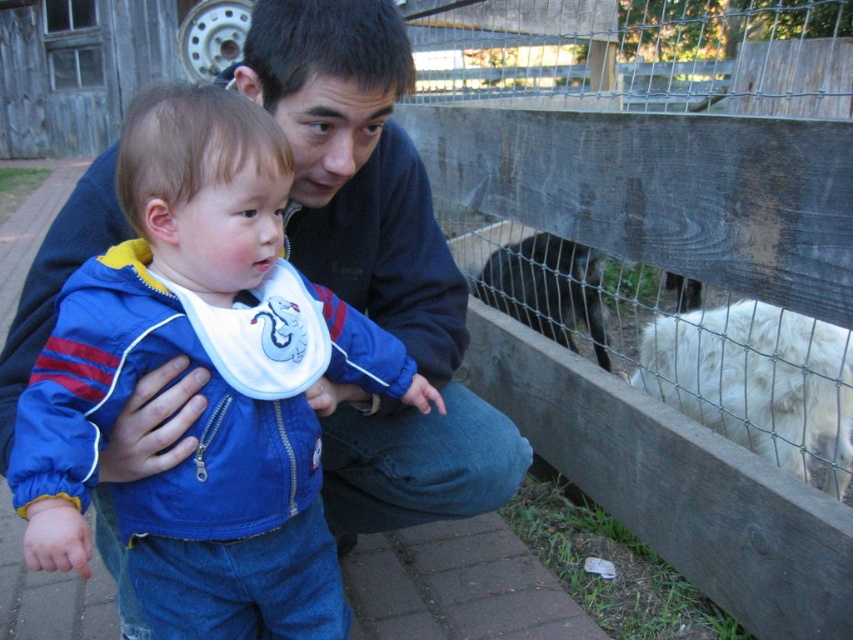
Can you confirm if wooden fence at center is shorter than white fluffy sheep at right?

Correct, wooden fence at center is not as tall as white fluffy sheep at right.

Which is in front, point (543, 445) or point (819, 352)?

Point (819, 352)

What do you see at coordinates (664, 269) in the screenshot? I see `wooden fence at center` at bounding box center [664, 269].

Find the location of `wooden fence at center`. wooden fence at center is located at coordinates [664, 269].

Who is higher up, wooden fence at center or matte blue jacket at center?

wooden fence at center is higher up.

Does point (706, 284) come behind point (279, 314)?

Yes, point (706, 284) is farther from viewer.

This screenshot has height=640, width=853. I want to click on wooden fence at center, so click(x=664, y=269).

In the scene shown: Does white fluffy sheep at right appear on the right side of dark brown fur at upper center?

Indeed, white fluffy sheep at right is positioned on the right side of dark brown fur at upper center.

Does white fluffy sheep at right have a greater height compared to dark brown fur at upper center?

Indeed, white fluffy sheep at right has a greater height compared to dark brown fur at upper center.

Locate an element on the screen. The width and height of the screenshot is (853, 640). white fluffy sheep at right is located at coordinates (758, 381).

The image size is (853, 640). In order to click on white fluffy sheep at right in this screenshot , I will do `click(758, 381)`.